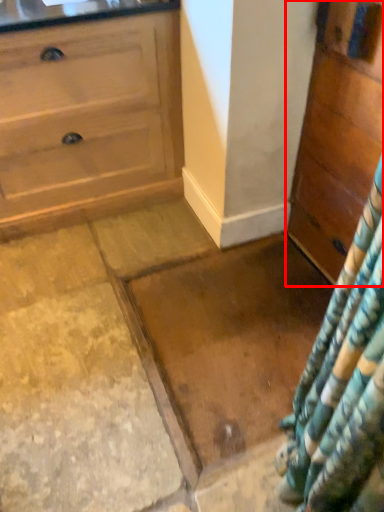
Question: From the image's perspective, what is the correct spatial relationship of chest of drawers (annotated by the red box) in relation to granite?

Choices:
 (A) above
 (B) below

Answer: (A)